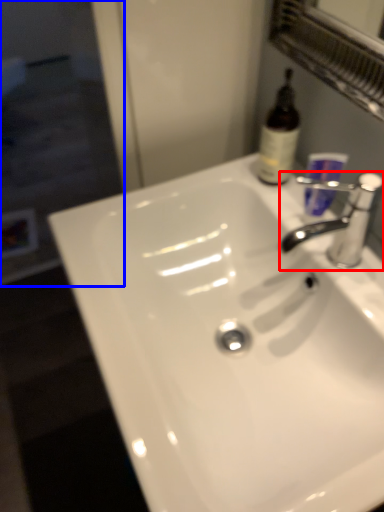
Question: Among these objects, which one is farthest to the camera, tap (highlighted by a red box) or screen door (highlighted by a blue box)?

Choices:
 (A) tap
 (B) screen door

Answer: (B)